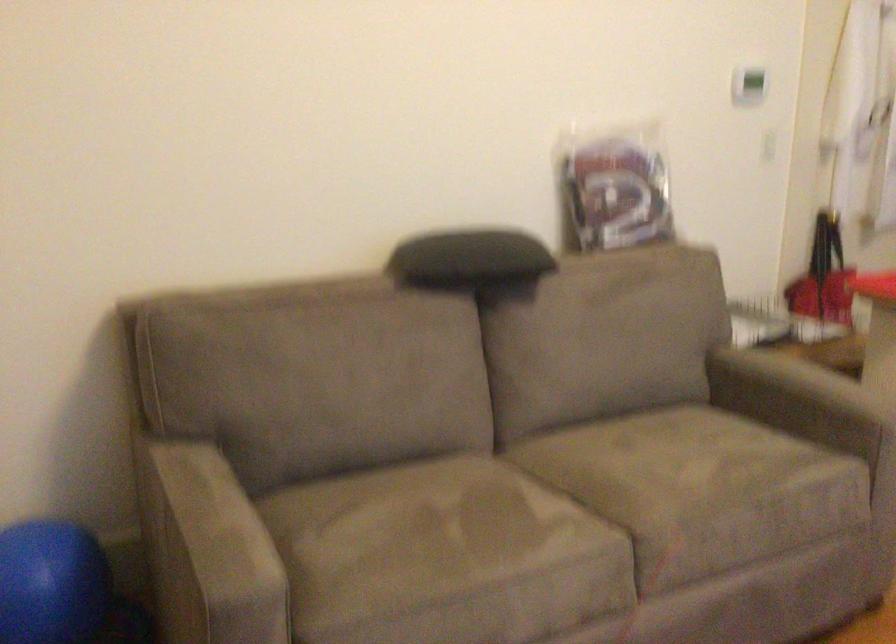
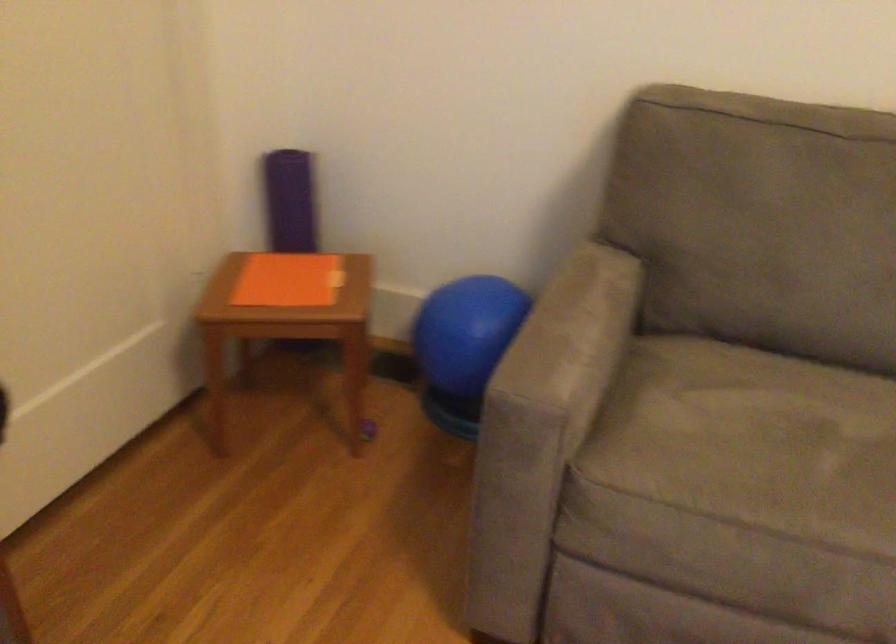
The point at (226, 521) is marked in the first image. Where is the corresponding point in the second image?

(572, 333)